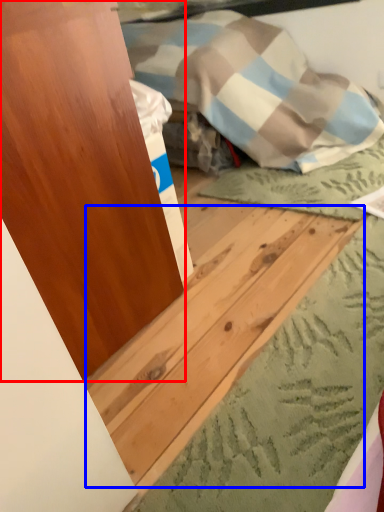
Question: Which of the following is the closest to the observer, dresser (highlighted by a red box) or plywood (highlighted by a blue box)?

Choices:
 (A) dresser
 (B) plywood

Answer: (B)